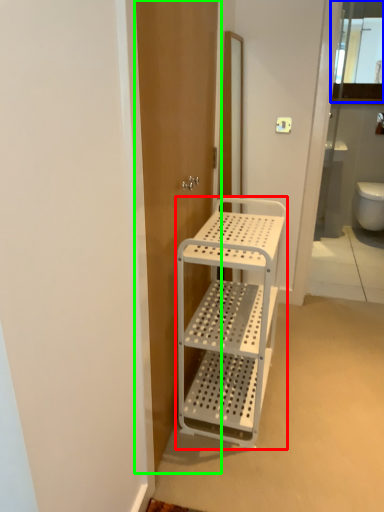
Question: Estimate the real-world distances between objects in this image. Which object is farther from furniture (highlighted by a red box), cabinet (highlighted by a blue box) or screen door (highlighted by a green box)?

Choices:
 (A) cabinet
 (B) screen door

Answer: (A)